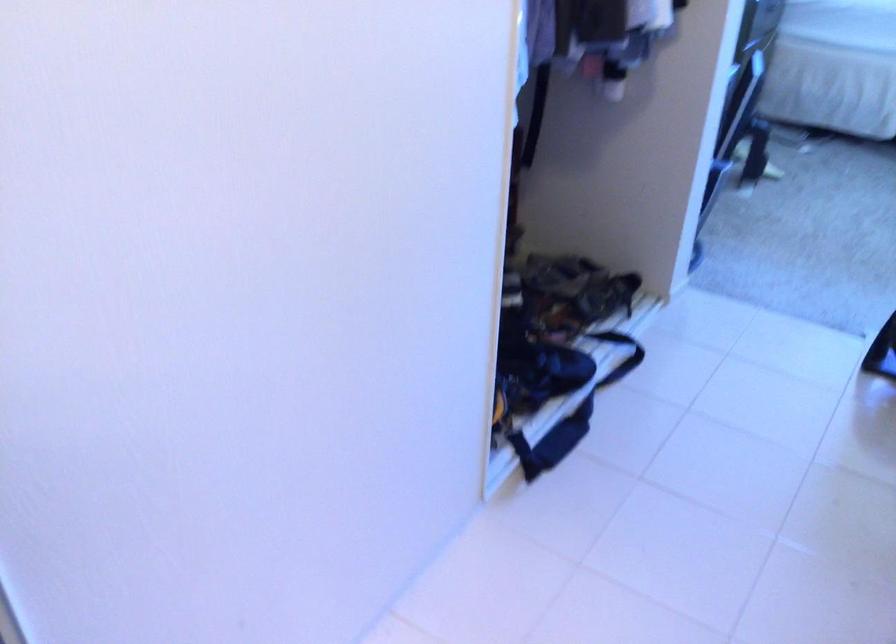
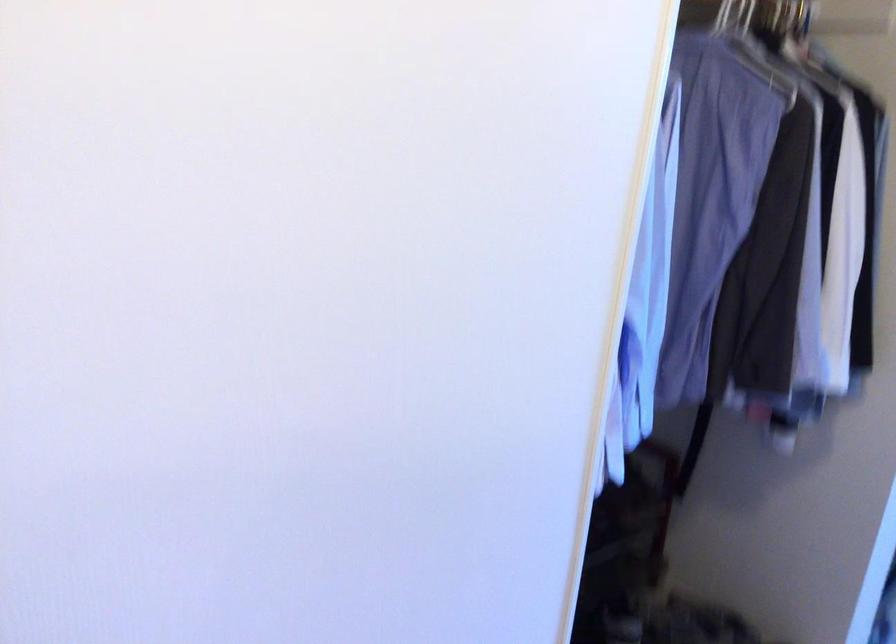
Consider the image. How did the camera likely rotate?

The camera's rotation is toward left-up.